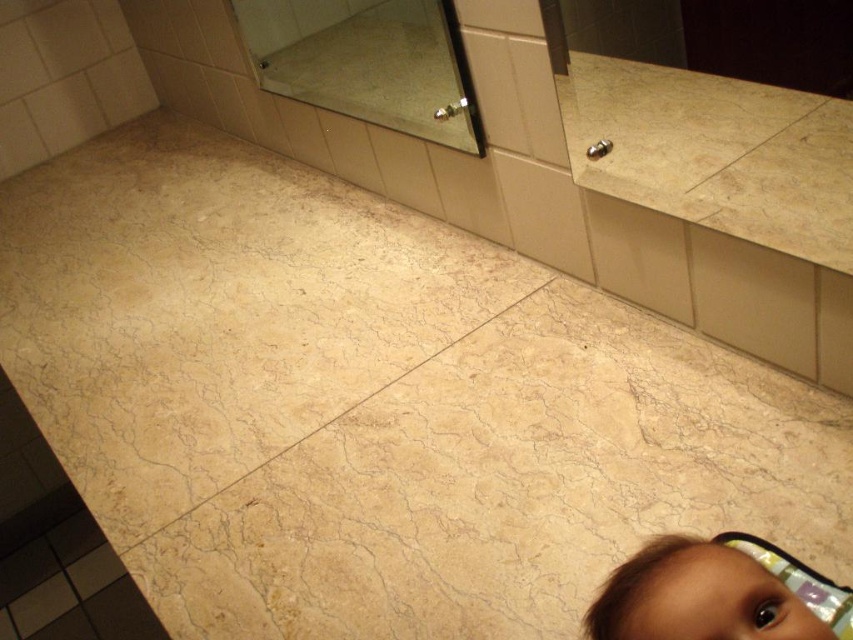
Question: Is clear glass mirror at upper center to the left of brown hair at lower right from the viewer's perspective?

Choices:
 (A) yes
 (B) no

Answer: (A)

Question: Is clear glass mirror at upper center bigger than brown hair at lower right?

Choices:
 (A) yes
 (B) no

Answer: (A)

Question: Which of the following is the farthest from the observer?

Choices:
 (A) brown hair at lower right
 (B) clear glass mirror at upper center

Answer: (B)

Question: Can you confirm if clear glass mirror at upper center is smaller than brown hair at lower right?

Choices:
 (A) yes
 (B) no

Answer: (B)